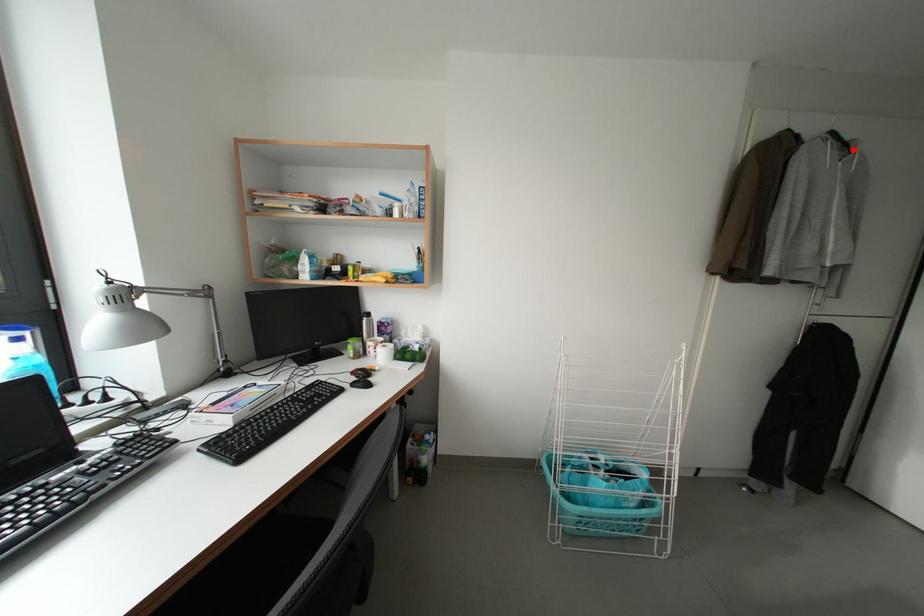
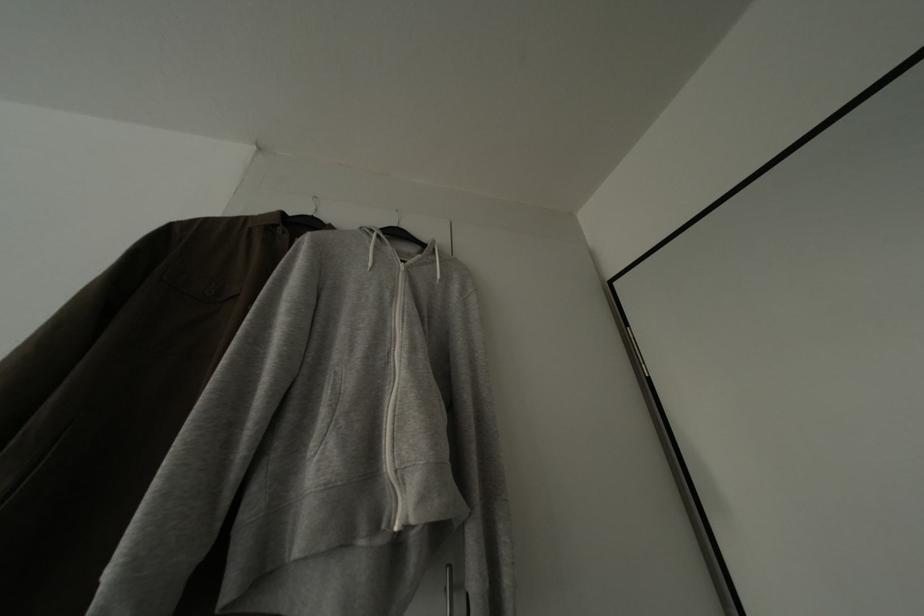
Question: I am providing you with two images of the same scene from different viewpoints. Image1 has a red point marked. In image2, the corresponding 3D location appears at what relative position? Reply with the corresponding letter.

Choices:
 (A) Closer
 (B) Farther

Answer: (A)